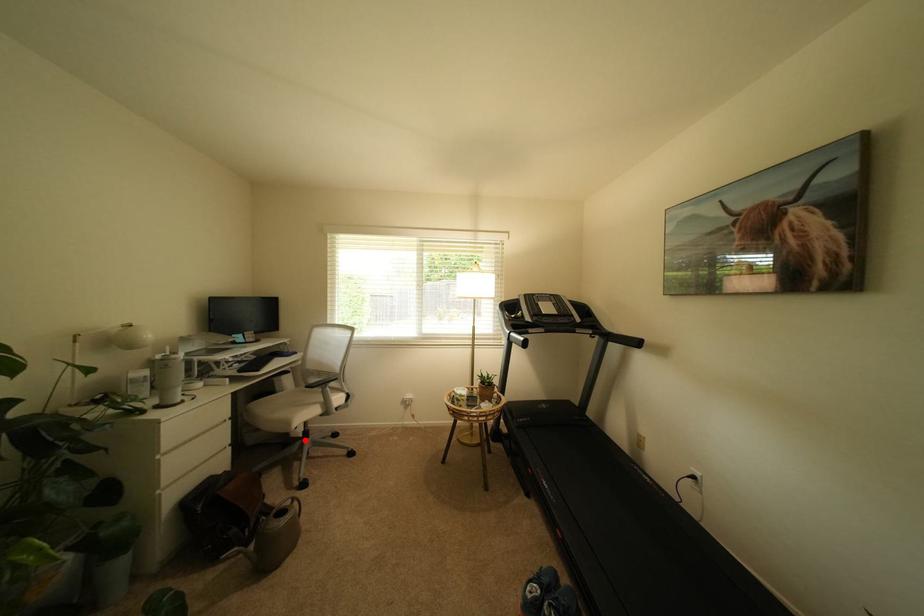
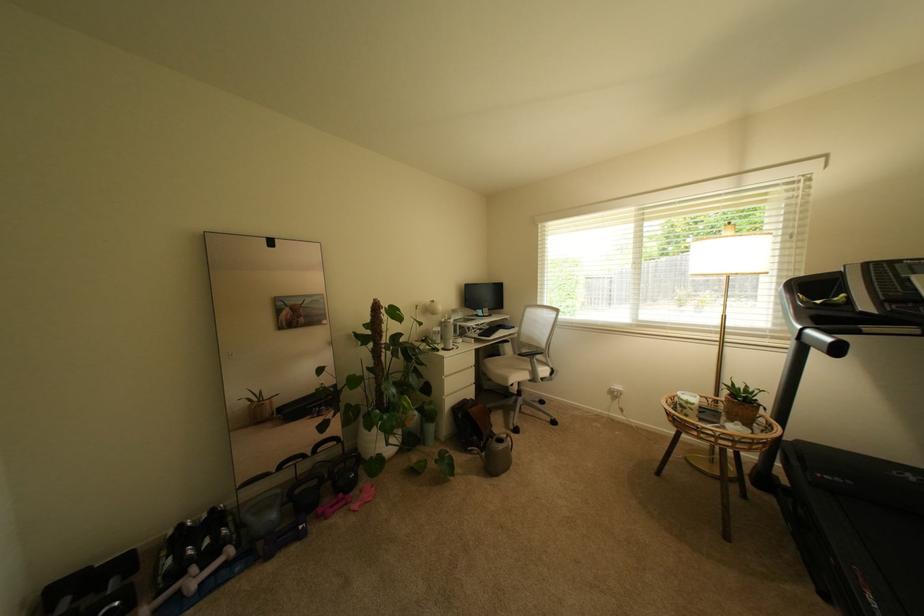
Question: A red point is marked in image1. In image2, is the corresponding 3D point closer to the camera or farther? Reply with the corresponding letter.

Choices:
 (A) The corresponding 3D point is closer.
 (B) The corresponding 3D point is farther.

Answer: (B)